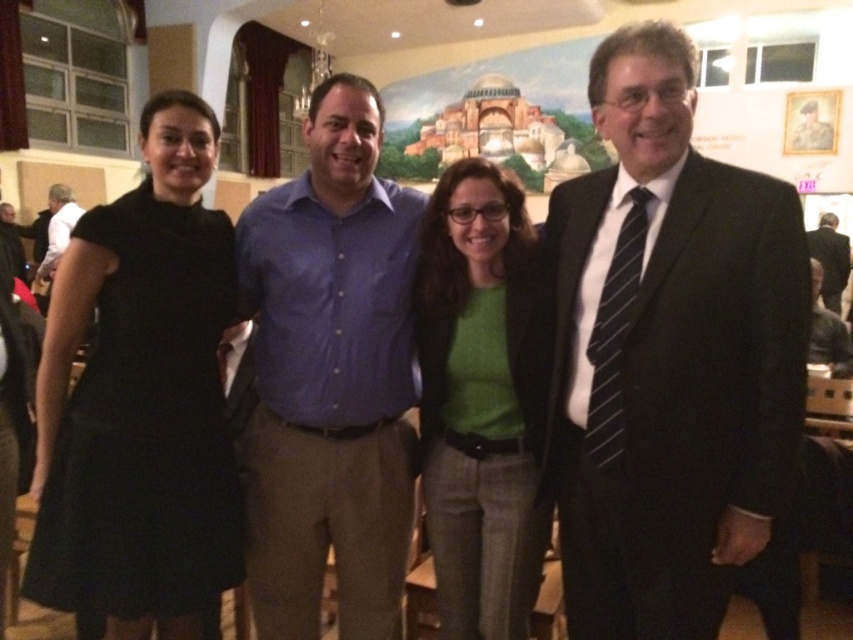
Question: Which of these objects is positioned farthest from the green matte shirt at center?

Choices:
 (A) black suit at right
 (B) blue button-down shirt at center

Answer: (A)

Question: Can you confirm if matte black suit at right is positioned above black suit at right?

Choices:
 (A) yes
 (B) no

Answer: (B)

Question: Can you confirm if blue button-down shirt at center is positioned above black dress at left?

Choices:
 (A) no
 (B) yes

Answer: (B)

Question: Which object appears closest to the camera in this image?

Choices:
 (A) green matte shirt at center
 (B) black suit at right
 (C) matte black suit at right

Answer: (C)

Question: Which object is positioned closest to the dark brown leather jacket at lower right?

Choices:
 (A) black suit at right
 (B) black dress at left
 (C) green matte shirt at center
 (D) matte black suit at right

Answer: (C)

Question: Is blue button-down shirt at center smaller than black dress at left?

Choices:
 (A) yes
 (B) no

Answer: (B)